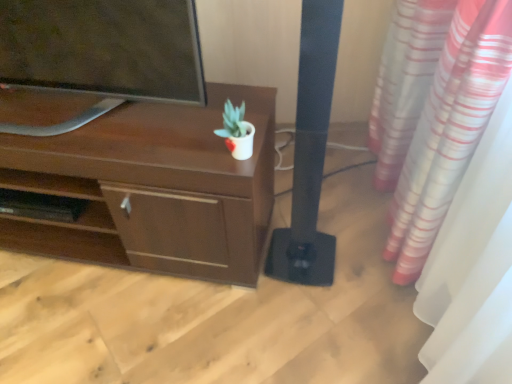
Locate an element on the screen. This screenshot has height=384, width=512. vacant space that is to the left of white glossy pot at center is located at coordinates coord(187,151).